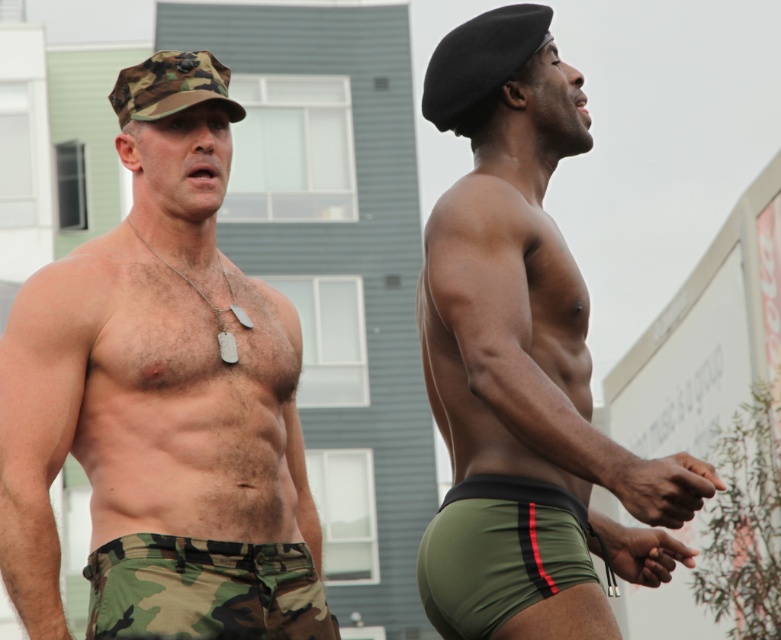
You are a photographer trying to capture the camo fabric shorts at left. You have a camera with a rectangular viewfinder. The viewfinder is currently centered on the point marked by point (161, 401). To ensure the camo fabric shorts at left are fully visible in the photo, should you move the viewfinder to the left or right?

The point (161, 401) marks the camo fabric shorts at left, so moving the viewfinder to the left would move it away from the subject. To keep the camo fabric shorts at left in frame, you should not move it left. However, since the question asks whether to move left or right to ensure full visibility, the correct answer depends on the viewfinder size. If the viewfinder is already centered on the point marking the shorts, moving it right might risk cropping the left side. But according to the description, it

In the scene shown: You are a fashion designer analyzing the clothing items in the image. Which clothing item is positioned lower on the body between the camo fabric shorts at left and the olive green spandex briefs at right?

The camo fabric shorts at left is positioned lower on the body than the olive green spandex briefs at right.